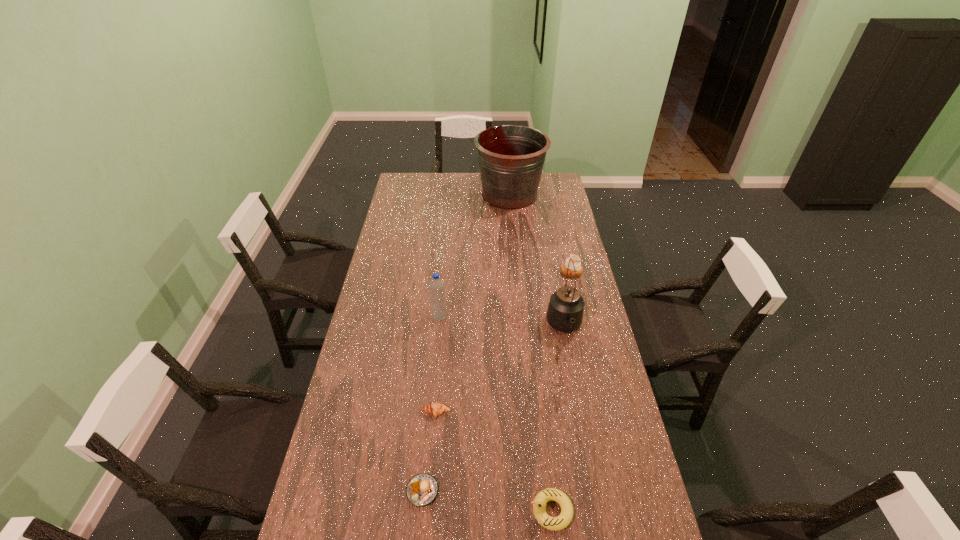
Where is `vacant space in between the farthest pastry and the fifth farthest object`? Image resolution: width=960 pixels, height=540 pixels. vacant space in between the farthest pastry and the fifth farthest object is located at coordinates (504, 342).

In order to click on free space between the nearest pastry and the fifth shortest object in this screenshot , I will do `click(431, 404)`.

I want to click on empty space between the farthest pastry and the duckling, so click(562, 391).

Identify the location of vacant point located between the duckling and the kettle. (558, 419).

The width and height of the screenshot is (960, 540). What are the coordinates of `free space between the second farthest object and the nearest pastry` in the screenshot? It's located at (497, 381).

Image resolution: width=960 pixels, height=540 pixels. Find the location of `vacant space that is in between the water bottle and the farthest object`. vacant space that is in between the water bottle and the farthest object is located at coordinates (474, 255).

The height and width of the screenshot is (540, 960). Identify the location of object that can be found as the fourth closest to the nearest pastry. (565, 311).

Select which object is the closest to the tallest pastry. Please provide its 2D coordinates. Your answer should be formatted as a tuple, i.e. [(x, y)], where the tuple contains the x and y coordinates of a point satisfying the conditions above.

[(565, 311)]

Identify which pastry is the nearest to the second nearest pastry. Please provide its 2D coordinates. Your answer should be formatted as a tuple, i.e. [(x, y)], where the tuple contains the x and y coordinates of a point satisfying the conditions above.

[(422, 489)]

At what (x,y) coordinates should I click in order to perform the action: click on pastry that is the third closest to the duckling. Please return your answer as a coordinate pair (x, y). Looking at the image, I should click on (576, 259).